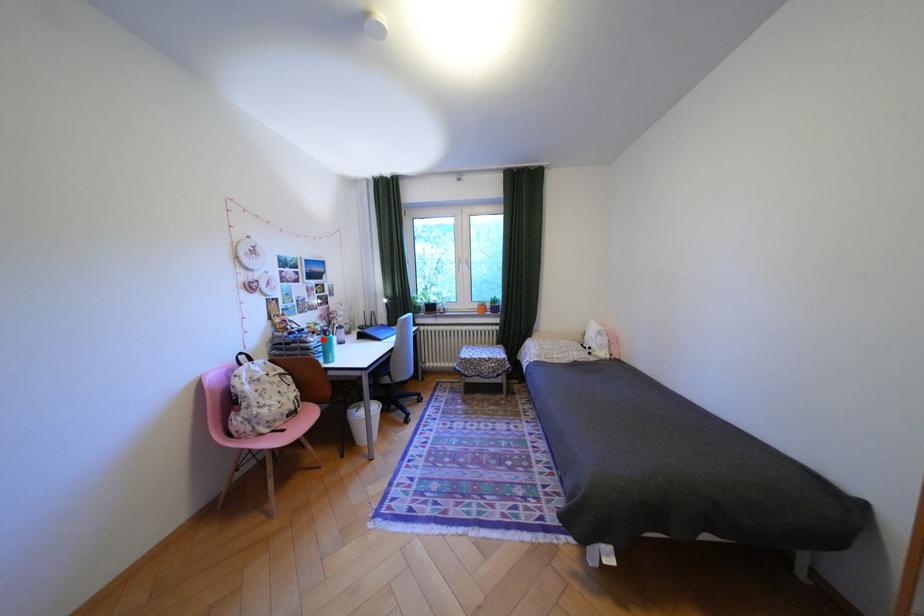
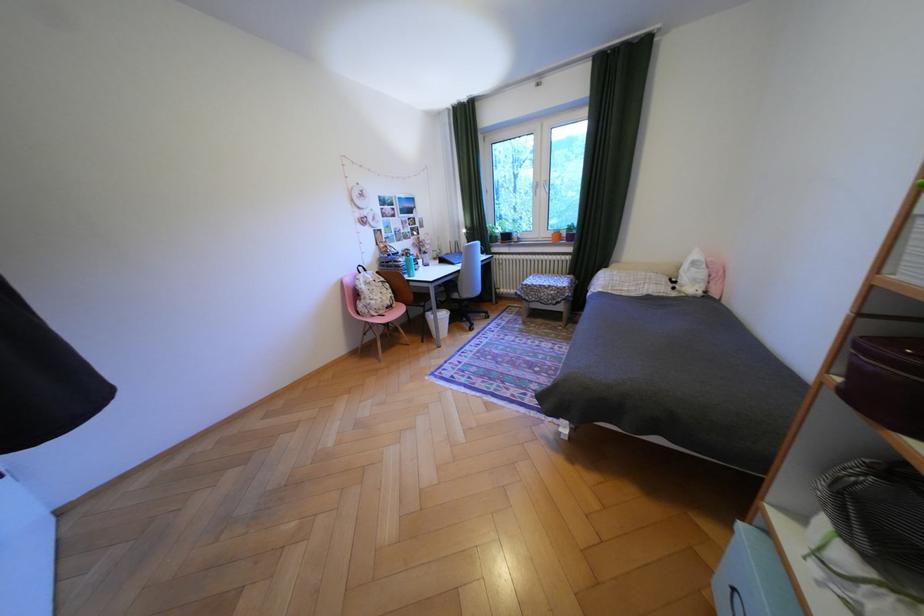
The point at the highlighted location is marked in the first image. Where is the corresponding point in the second image?

(411, 259)